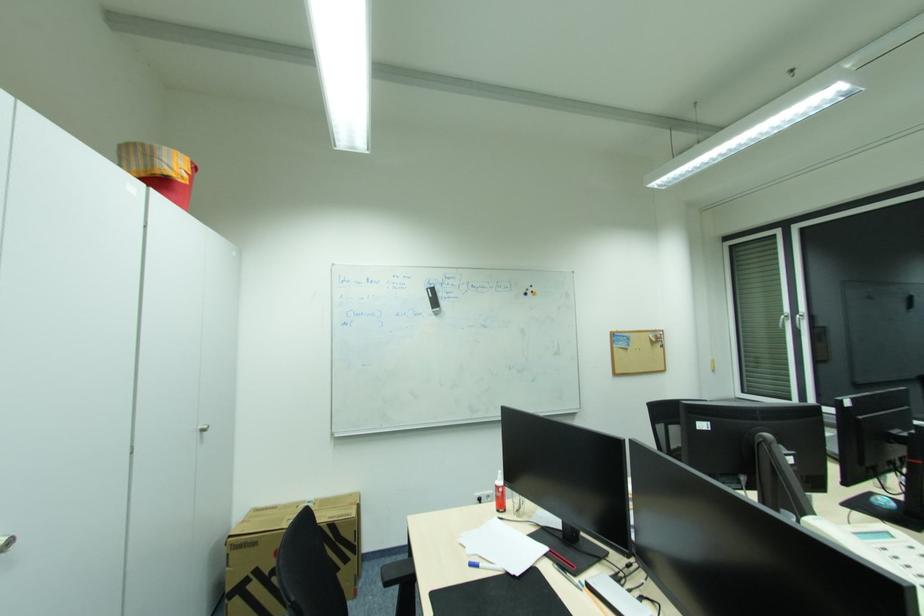
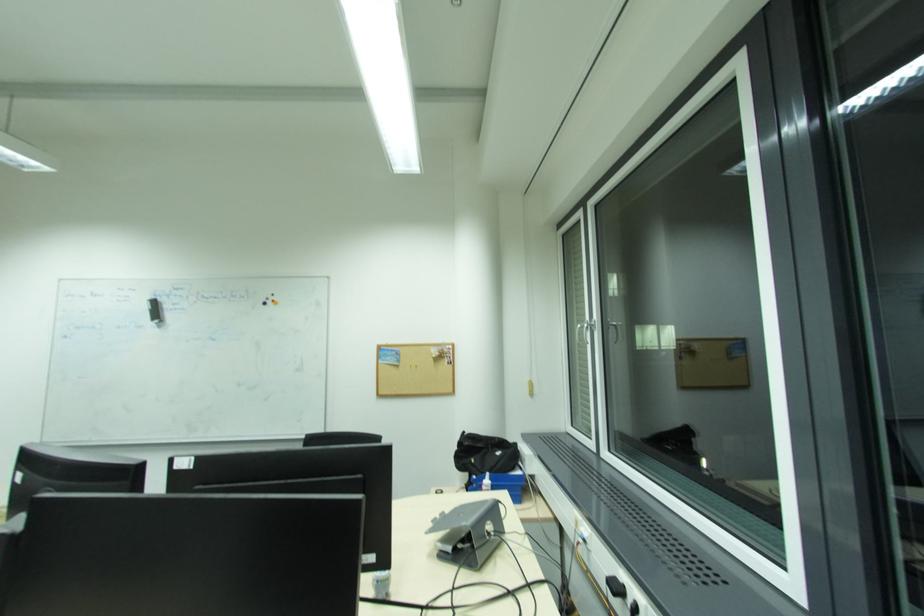
Question: What movement of the cameraman would produce the second image?

Choices:
 (A) Left
 (B) Right
 (C) Forward
 (D) Backward

Answer: (B)